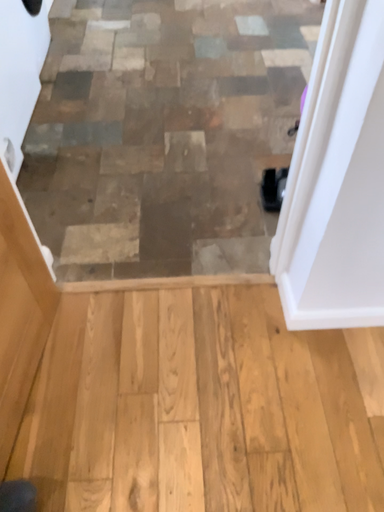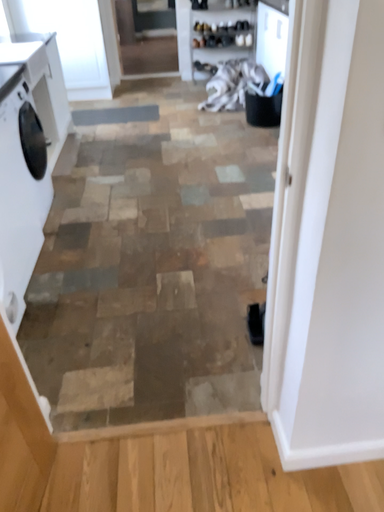
Question: How did the camera likely rotate when shooting the video?

Choices:
 (A) rotated upward
 (B) rotated downward

Answer: (A)